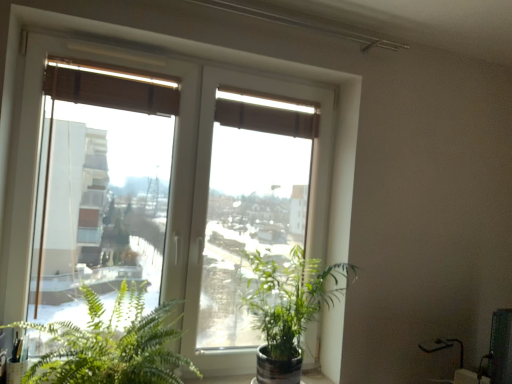
Identify the location of blank space situated above transparent glass window at center (from a real-world perspective). This screenshot has width=512, height=384. (180, 58).